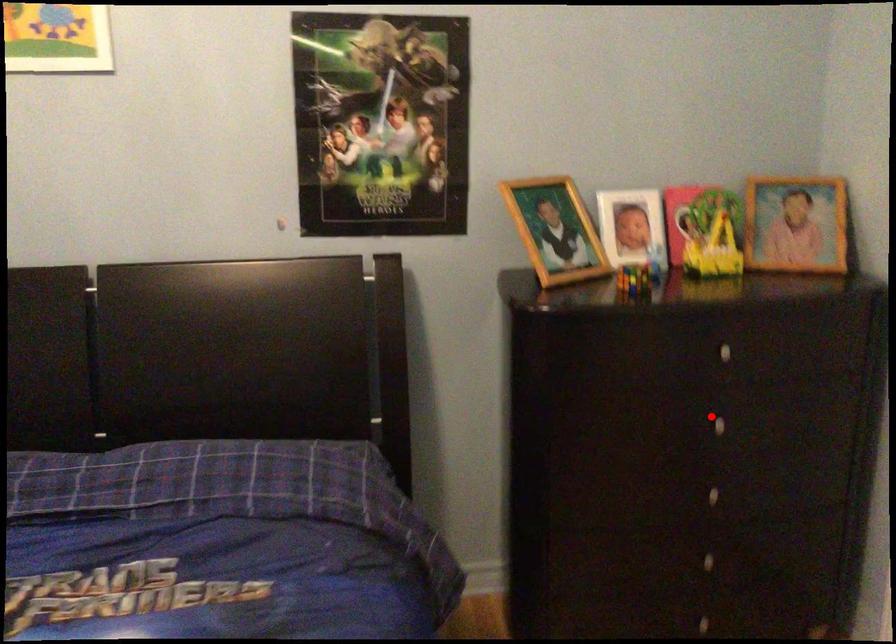
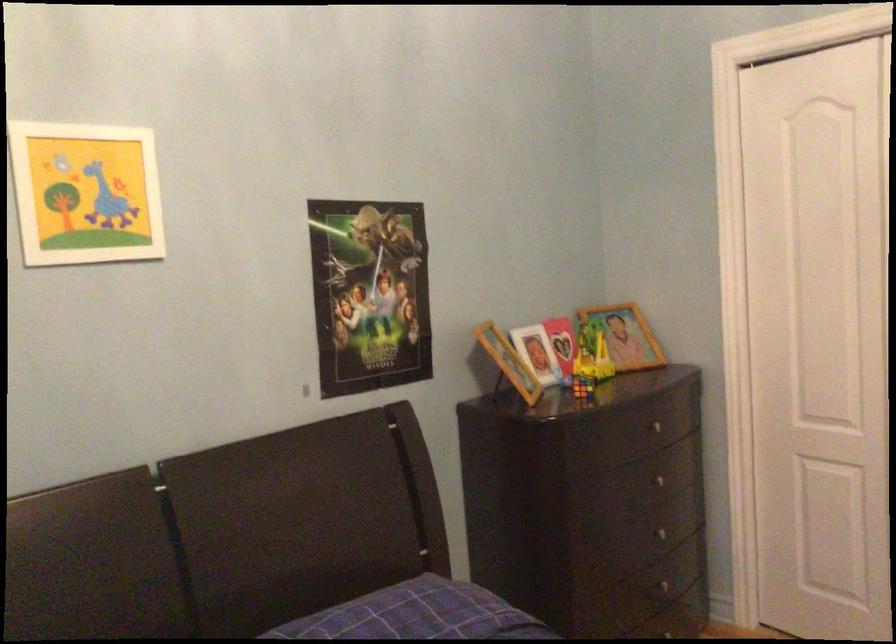
Question: A red point is marked in image1. In image2, is the corresponding 3D point closer to the camera or farther? Reply with the corresponding letter.

Choices:
 (A) The corresponding 3D point is closer.
 (B) The corresponding 3D point is farther.

Answer: (B)